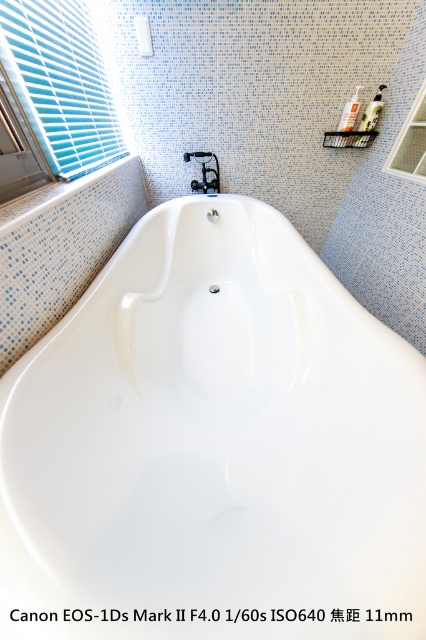
Question: Which is nearer to the blue plastic blinds at upper left?

Choices:
 (A) clear glass window at upper right
 (B) white glossy bathtub at center

Answer: (B)

Question: Is white glossy bathtub at center behind clear glass window at upper right?

Choices:
 (A) no
 (B) yes

Answer: (A)

Question: Can you confirm if white glossy bathtub at center is wider than black plastic faucet at center?

Choices:
 (A) yes
 (B) no

Answer: (A)

Question: Estimate the real-world distances between objects in this image. Which object is closer to the blue plastic blinds at upper left?

Choices:
 (A) white glossy bathtub at center
 (B) black plastic faucet at center

Answer: (B)

Question: Is white glossy bathtub at center positioned at the back of blue plastic blinds at upper left?

Choices:
 (A) no
 (B) yes

Answer: (A)

Question: Which point is farther from the camera taking this photo?

Choices:
 (A) (63, 342)
 (B) (66, 60)

Answer: (B)